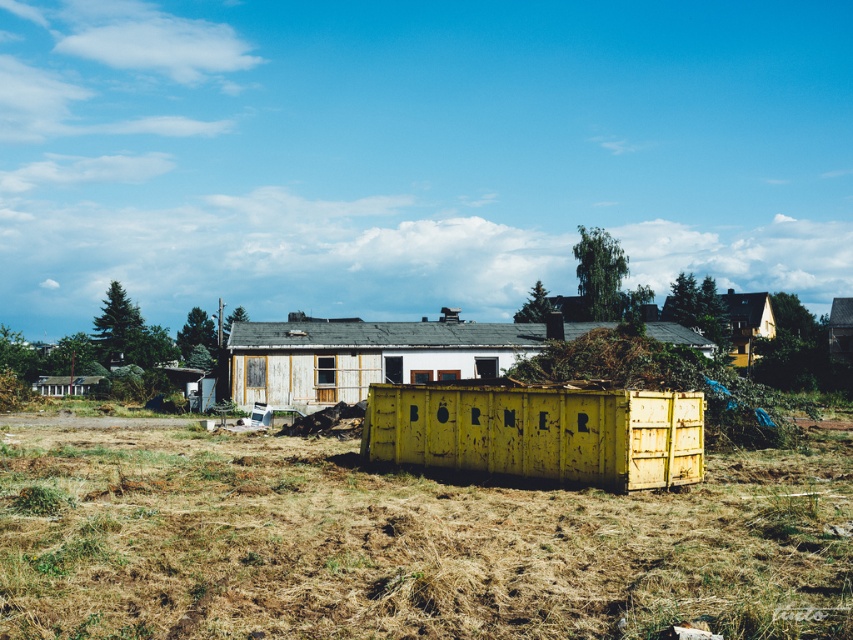
You are a construction worker who needs to place a new tool box on the ground near the dry grass at center and the yellow weathered container at center. Which object is shorter so that the toolbox can be placed closer to it without obstruction?

The dry grass at center has a lesser height compared to the yellow weathered container at center, so the toolbox can be placed closer to the dry grass at center without obstruction.